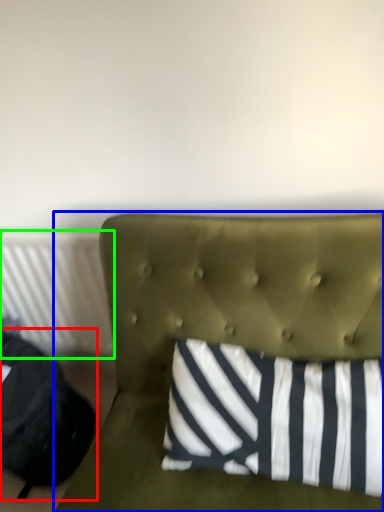
Question: Which object is the closest to the bean bag chair (highlighted by a red box)? Choose among these: furniture (highlighted by a blue box) or radiator (highlighted by a green box).

Choices:
 (A) furniture
 (B) radiator

Answer: (B)